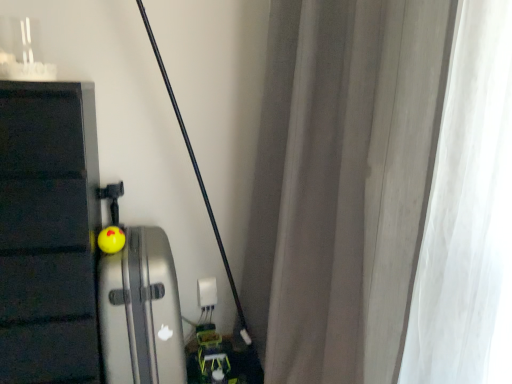
Image resolution: width=512 pixels, height=384 pixels. What do you see at coordinates (388, 193) in the screenshot? I see `white sheer curtain at right` at bounding box center [388, 193].

Image resolution: width=512 pixels, height=384 pixels. Describe the element at coordinates (141, 311) in the screenshot. I see `silver metallic suitcase at left` at that location.

The image size is (512, 384). I want to click on yellow rubber ball at center, so click(x=111, y=240).

Where is `white sheer curtain at right`? The width and height of the screenshot is (512, 384). white sheer curtain at right is located at coordinates pyautogui.click(x=388, y=193).

From the picture: Does silver metallic suitcase at left touch white sheer curtain at right?

No, silver metallic suitcase at left is not in contact with white sheer curtain at right.

From the image's perspective, relative to white sheer curtain at right, is silver metallic suitcase at left above or below?

silver metallic suitcase at left is below white sheer curtain at right.

Could you tell me if silver metallic suitcase at left is turned towards white sheer curtain at right?

No.

Is silver metallic suitcase at left beside white plastic electric outlet at center?

No, silver metallic suitcase at left is not touching white plastic electric outlet at center.

Considering the sizes of silver metallic suitcase at left and white plastic electric outlet at center in the image, is silver metallic suitcase at left wider or thinner than white plastic electric outlet at center?

silver metallic suitcase at left is wider than white plastic electric outlet at center.

Considering the relative positions of silver metallic suitcase at left and white plastic electric outlet at center in the image provided, is silver metallic suitcase at left behind white plastic electric outlet at center?

No, it is in front of white plastic electric outlet at center.

Who is smaller, silver metallic suitcase at left or white plastic electric outlet at center?

Smaller between the two is white plastic electric outlet at center.

From a real-world perspective, is yellow rubber ball at center under silver metallic suitcase at left?

Actually, yellow rubber ball at center is physically above silver metallic suitcase at left in the real world.

Is yellow rubber ball at center positioned far away from silver metallic suitcase at left?

That's not correct — yellow rubber ball at center is a little close to silver metallic suitcase at left.

Is yellow rubber ball at center positioned beyond the bounds of silver metallic suitcase at left?

No, yellow rubber ball at center is inside silver metallic suitcase at left's boundary.

Consider the image. Which is more to the left, yellow rubber ball at center or silver metallic suitcase at left?

yellow rubber ball at center.

Is silver metallic suitcase at left oriented away from yellow rubber ball at center?

No, silver metallic suitcase at left's orientation is not away from yellow rubber ball at center.

Is silver metallic suitcase at left inside or outside of yellow rubber ball at center?

silver metallic suitcase at left is outside yellow rubber ball at center.

Is silver metallic suitcase at left in contact with yellow rubber ball at center?

No, silver metallic suitcase at left is not with yellow rubber ball at center.

Is white sheer curtain at right positioned far away from silver metallic suitcase at left?

white sheer curtain at right is near silver metallic suitcase at left, not far away.

How different are the orientations of white sheer curtain at right and silver metallic suitcase at left in degrees?

There is a 91.6-degree angle between the facing directions of white sheer curtain at right and silver metallic suitcase at left.

Which object is closer to the camera taking this photo, white sheer curtain at right or silver metallic suitcase at left?

white sheer curtain at right.

Is white sheer curtain at right inside the boundaries of silver metallic suitcase at left, or outside?

white sheer curtain at right exists outside the volume of silver metallic suitcase at left.

Does white plastic electric outlet at center touch silver metallic suitcase at left?

No, white plastic electric outlet at center is not next to silver metallic suitcase at left.

Between white plastic electric outlet at center and silver metallic suitcase at left, which one has smaller size?

Smaller between the two is white plastic electric outlet at center.

Which object is thinner, white plastic electric outlet at center or silver metallic suitcase at left?

With smaller width is white plastic electric outlet at center.

Is white plastic electric outlet at center further to camera compared to silver metallic suitcase at left?

Yes, the depth of white plastic electric outlet at center is greater than that of silver metallic suitcase at left.

From the picture: Is yellow rubber ball at center next to white sheer curtain at right?

No, yellow rubber ball at center is not touching white sheer curtain at right.

Would you say yellow rubber ball at center is to the left or to the right of white sheer curtain at right in the picture?

From the image, it's evident that yellow rubber ball at center is to the left of white sheer curtain at right.

From the image's perspective, is yellow rubber ball at center located beneath white sheer curtain at right?

Yes, from the image's perspective, yellow rubber ball at center is beneath white sheer curtain at right.

How different are the orientations of yellow rubber ball at center and white sheer curtain at right in degrees?

The angular difference between yellow rubber ball at center and white sheer curtain at right is 91.6 degrees.

There is a silver metallic suitcase at left. Where is `curtain above it (from a real-world perspective)`? The image size is (512, 384). curtain above it (from a real-world perspective) is located at coordinates (388, 193).

Where is `appliance to the left of white plastic electric outlet at center`? appliance to the left of white plastic electric outlet at center is located at coordinates (141, 311).

Which object lies further to the anchor point white plastic electric outlet at center, white sheer curtain at right or silver metallic suitcase at left?

A: white sheer curtain at right is further to white plastic electric outlet at center.

Considering their positions, is white plastic electric outlet at center positioned closer to white sheer curtain at right than yellow rubber ball at center?

The object closer to white sheer curtain at right is yellow rubber ball at center.

Based on their spatial positions, is silver metallic suitcase at left or yellow rubber ball at center closer to white sheer curtain at right?

Among the two, silver metallic suitcase at left is located nearer to white sheer curtain at right.

When comparing their distances from white plastic electric outlet at center, does silver metallic suitcase at left or yellow rubber ball at center seem further?

yellow rubber ball at center is further to white plastic electric outlet at center.

Estimate the real-world distances between objects in this image. Which object is closer to silver metallic suitcase at left, white plastic electric outlet at center or yellow rubber ball at center?

yellow rubber ball at center.

Based on their spatial positions, is yellow rubber ball at center or silver metallic suitcase at left closer to white sheer curtain at right?

silver metallic suitcase at left lies closer to white sheer curtain at right than the other object.

Estimate the real-world distances between objects in this image. Which object is closer to white plastic electric outlet at center, white sheer curtain at right or yellow rubber ball at center?

The object closer to white plastic electric outlet at center is yellow rubber ball at center.

Looking at this image, from the image, which object appears to be nearer to white sheer curtain at right, yellow rubber ball at center or white plastic electric outlet at center?

yellow rubber ball at center is positioned closer to the anchor white sheer curtain at right.

I want to click on appliance located between white sheer curtain at right and white plastic electric outlet at center in the depth direction, so click(141, 311).

Identify the location of toy between white sheer curtain at right and white plastic electric outlet at center along the z-axis. (111, 240).

Where is `toy between silver metallic suitcase at left and white plastic electric outlet at center in the front-back direction`? toy between silver metallic suitcase at left and white plastic electric outlet at center in the front-back direction is located at coordinates (111, 240).

The width and height of the screenshot is (512, 384). Find the location of `appliance between white sheer curtain at right and yellow rubber ball at center along the z-axis`. appliance between white sheer curtain at right and yellow rubber ball at center along the z-axis is located at coordinates (141, 311).